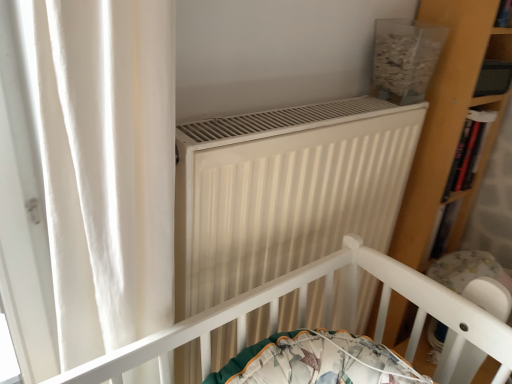
Question: Considering the relative sizes of wooden bookshelf at right and white matte radiator at center in the image provided, is wooden bookshelf at right smaller than white matte radiator at center?

Choices:
 (A) yes
 (B) no

Answer: (A)

Question: Considering the relative sizes of wooden bookshelf at right and white matte radiator at center in the image provided, is wooden bookshelf at right shorter than white matte radiator at center?

Choices:
 (A) no
 (B) yes

Answer: (B)

Question: Is wooden bookshelf at right bigger than white matte radiator at center?

Choices:
 (A) no
 (B) yes

Answer: (A)

Question: Is wooden bookshelf at right at the left side of white matte radiator at center?

Choices:
 (A) yes
 (B) no

Answer: (B)

Question: Considering the relative positions of wooden bookshelf at right and white matte radiator at center in the image provided, is wooden bookshelf at right to the right of white matte radiator at center from the viewer's perspective?

Choices:
 (A) yes
 (B) no

Answer: (A)

Question: Is wooden bookshelf at right aimed at white matte radiator at center?

Choices:
 (A) yes
 (B) no

Answer: (B)

Question: From a real-world perspective, is wooden bookshelf at right physically above white plastic baby carriage at lower right?

Choices:
 (A) yes
 (B) no

Answer: (A)

Question: Is wooden bookshelf at right taller than white plastic baby carriage at lower right?

Choices:
 (A) no
 (B) yes

Answer: (B)

Question: Can you confirm if wooden bookshelf at right is wider than white plastic baby carriage at lower right?

Choices:
 (A) no
 (B) yes

Answer: (A)

Question: Does wooden bookshelf at right appear on the right side of white plastic baby carriage at lower right?

Choices:
 (A) yes
 (B) no

Answer: (B)

Question: Is wooden bookshelf at right touching white plastic baby carriage at lower right?

Choices:
 (A) yes
 (B) no

Answer: (B)

Question: From the image's perspective, is wooden bookshelf at right under white plastic baby carriage at lower right?

Choices:
 (A) no
 (B) yes

Answer: (A)

Question: From a real-world perspective, does white plastic baby carriage at lower right stand above white matte radiator at center?

Choices:
 (A) no
 (B) yes

Answer: (A)